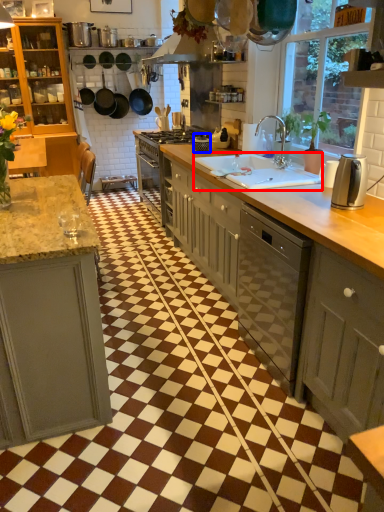
Question: Which of the following is the closest to the observer, sink (highlighted by a red box) or appliance (highlighted by a blue box)?

Choices:
 (A) sink
 (B) appliance

Answer: (A)